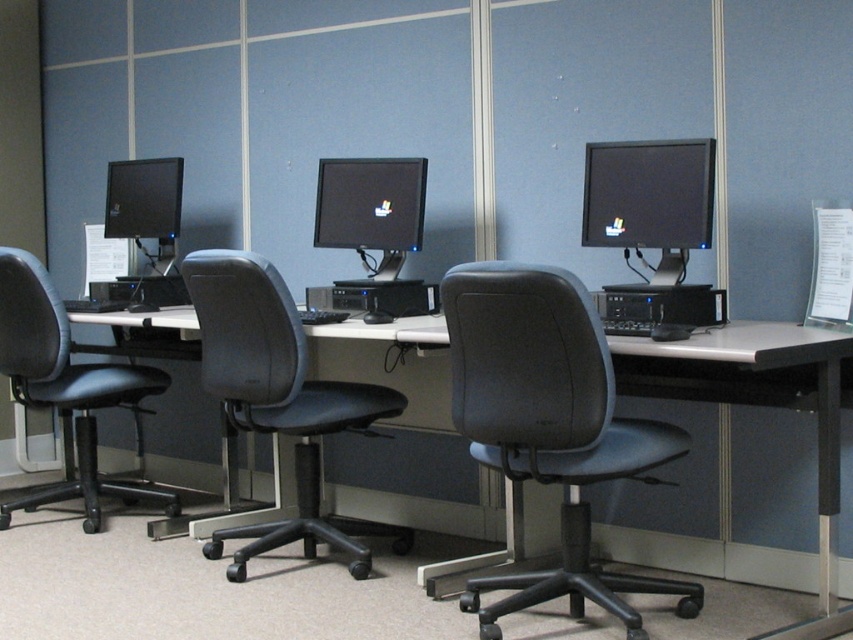
Question: Which point is farther from the camera taking this photo?

Choices:
 (A) (219, 552)
 (B) (439, 428)
 (C) (344, 224)
 (D) (115, 177)

Answer: (D)

Question: Is black leather swivel chair at center further to camera compared to matte black monitor at center?

Choices:
 (A) yes
 (B) no

Answer: (B)

Question: Estimate the real-world distances between objects in this image. Which object is closer to the black plastic desk at center?

Choices:
 (A) matte black monitor at center
 (B) matte black monitor at left

Answer: (A)

Question: Is gray leather swivel chair at center bigger than matte black monitor at center?

Choices:
 (A) no
 (B) yes

Answer: (B)

Question: Is gray leather swivel chair at center behind black plastic desk at center?

Choices:
 (A) yes
 (B) no

Answer: (A)

Question: Among these objects, which one is farthest from the camera?

Choices:
 (A) matte black monitor at left
 (B) black leather swivel chair at center

Answer: (A)